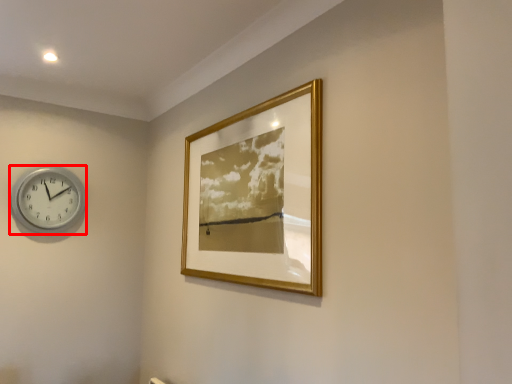
Question: From the image's perspective, where is wall clock (annotated by the red box) located relative to picture frame?

Choices:
 (A) below
 (B) above

Answer: (A)